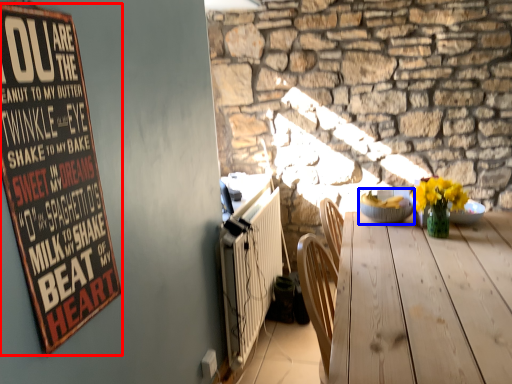
Question: Which of the following is the closest to the observer, bulletin board (highlighted by a red box) or bowl (highlighted by a blue box)?

Choices:
 (A) bulletin board
 (B) bowl

Answer: (A)